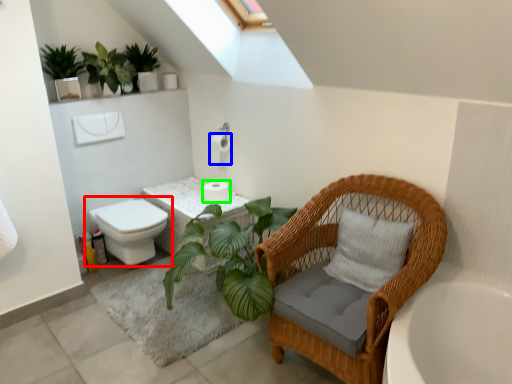
Question: Based on their relative distances, which object is nearer to toilet (highlighted by a red box)? Choose from toilet paper (highlighted by a blue box) and toilet paper (highlighted by a green box).

Choices:
 (A) toilet paper
 (B) toilet paper

Answer: (B)